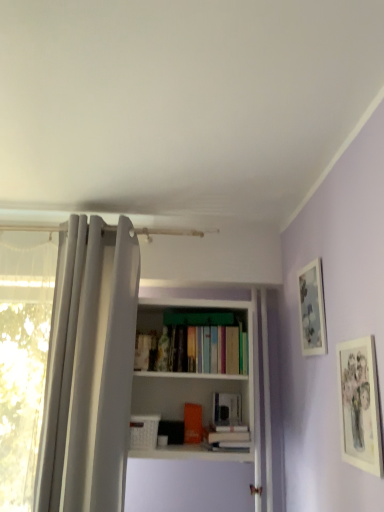
Where is `white fabric shower curtain at left`? The height and width of the screenshot is (512, 384). white fabric shower curtain at left is located at coordinates (92, 373).

This screenshot has width=384, height=512. Describe the element at coordinates (226, 409) in the screenshot. I see `hardcover book at center, placed as the 1th book when sorted from right to left` at that location.

In order to face white matte bookshelf at center, should I rotate leftwards or rightwards?

Rotate your view right by about 0.199°.

Measure the distance between point (x=373, y=339) and camera.

They are 1.10 meters apart.

The image size is (384, 512). What do you see at coordinates (312, 309) in the screenshot? I see `matte silver picture frame at upper right, which is the first picture frame from back to front` at bounding box center [312, 309].

The image size is (384, 512). What are the coordinates of `orange matte bookshelf at center, which is counted as the 1th book, starting from the left` in the screenshot? It's located at (192, 423).

Is white matte bookshelf at center at the right side of matte paper picture frame at right, the first picture frame viewed from the front?

In fact, white matte bookshelf at center is to the left of matte paper picture frame at right, the first picture frame viewed from the front.

Consider the image. Are white matte bookshelf at center and matte paper picture frame at right, the first picture frame viewed from the front, located far from each other?

No, white matte bookshelf at center is not far from matte paper picture frame at right, the first picture frame viewed from the front.

Is white matte bookshelf at center not inside matte paper picture frame at right, the first picture frame viewed from the front?

white matte bookshelf at center is positioned outside matte paper picture frame at right, the first picture frame viewed from the front.

Is white matte bookshelf at center smaller than matte paper picture frame at right, the first picture frame viewed from the front?

Actually, white matte bookshelf at center might be larger than matte paper picture frame at right, the first picture frame viewed from the front.

Is orange matte bookshelf at center, which is counted as the 1th book, starting from the left, next to white matte bookshelf at center and touching it?

No, orange matte bookshelf at center, which is counted as the 1th book, starting from the left, is not with white matte bookshelf at center.

Considering the sizes of objects orange matte bookshelf at center, the 2th book positioned from the right, and white matte bookshelf at center in the image provided, who is smaller, orange matte bookshelf at center, the 2th book positioned from the right, or white matte bookshelf at center?

Smaller between the two is orange matte bookshelf at center, the 2th book positioned from the right.

Which is more distant, (198,438) or (239,378)?

The point (198,438) is farther from the camera.

Is matte silver picture frame at upper right, which is the first picture frame from back to front, oriented away from white matte bookshelf at center?

No, matte silver picture frame at upper right, which is the first picture frame from back to front,'s orientation is not away from white matte bookshelf at center.

Identify the location of the 1st picture frame in front of the white matte bookshelf at center. The width and height of the screenshot is (384, 512). 312,309.

Based on the photo, is matte silver picture frame at upper right, which is the first picture frame from back to front, next to white matte bookshelf at center and touching it?

No, matte silver picture frame at upper right, which is the first picture frame from back to front, is not making contact with white matte bookshelf at center.

Is there a large distance between matte silver picture frame at upper right, the second picture frame when ordered from front to back, and matte paper picture frame at right, the first picture frame viewed from the front?

matte silver picture frame at upper right, the second picture frame when ordered from front to back, is actually quite close to matte paper picture frame at right, the first picture frame viewed from the front.

Would you say matte silver picture frame at upper right, which is the first picture frame from back to front, is to the left or to the right of matte paper picture frame at right, the first picture frame viewed from the front, in the picture?

From the image, it's evident that matte silver picture frame at upper right, which is the first picture frame from back to front, is to the left of matte paper picture frame at right, the first picture frame viewed from the front.

Is matte silver picture frame at upper right, which is the first picture frame from back to front, in front of or behind matte paper picture frame at right, which is counted as the second picture frame, starting from the back, in the image?

Clearly, matte silver picture frame at upper right, which is the first picture frame from back to front, is behind matte paper picture frame at right, which is counted as the second picture frame, starting from the back.

Based on their sizes in the image, would you say matte silver picture frame at upper right, which is the first picture frame from back to front, is bigger or smaller than matte paper picture frame at right, which is counted as the second picture frame, starting from the back?

In the image, matte silver picture frame at upper right, which is the first picture frame from back to front, appears to be larger than matte paper picture frame at right, which is counted as the second picture frame, starting from the back.

Is orange matte bookshelf at center, the 2th book positioned from the right, further to the viewer compared to matte paper picture frame at right, which is counted as the second picture frame, starting from the back?

Yes, orange matte bookshelf at center, the 2th book positioned from the right, is further from the camera.

Is orange matte bookshelf at center, which is counted as the 1th book, starting from the left, next to matte paper picture frame at right, the first picture frame viewed from the front, and touching it?

No, orange matte bookshelf at center, which is counted as the 1th book, starting from the left, is not with matte paper picture frame at right, the first picture frame viewed from the front.

Is white matte bookshelf at center wider than matte silver picture frame at upper right, the second picture frame when ordered from front to back?

Correct, the width of white matte bookshelf at center exceeds that of matte silver picture frame at upper right, the second picture frame when ordered from front to back.

What's the angular difference between white matte bookshelf at center and matte silver picture frame at upper right, the second picture frame when ordered from front to back,'s facing directions?

The angular difference between white matte bookshelf at center and matte silver picture frame at upper right, the second picture frame when ordered from front to back, is 90 degrees.

How distant is white matte bookshelf at center from matte silver picture frame at upper right, the second picture frame when ordered from front to back?

20.98 inches.

Identify the location of bookcase that appears below the matte silver picture frame at upper right, the second picture frame when ordered from front to back (from a real-world perspective). This screenshot has height=512, width=384. (203, 421).

Is white fabric shower curtain at left inside or outside of matte silver picture frame at upper right, the second picture frame when ordered from front to back?

white fabric shower curtain at left is not inside matte silver picture frame at upper right, the second picture frame when ordered from front to back, it's outside.

From the image's perspective, is white fabric shower curtain at left located above or below matte silver picture frame at upper right, which is the first picture frame from back to front?

From the image's perspective, white fabric shower curtain at left appears below matte silver picture frame at upper right, which is the first picture frame from back to front.

Is matte silver picture frame at upper right, the second picture frame when ordered from front to back, at the back of white fabric shower curtain at left?

That's not correct — white fabric shower curtain at left is not looking away from matte silver picture frame at upper right, the second picture frame when ordered from front to back.

Considering the relative sizes of white fabric shower curtain at left and matte silver picture frame at upper right, the second picture frame when ordered from front to back, in the image provided, is white fabric shower curtain at left smaller than matte silver picture frame at upper right, the second picture frame when ordered from front to back,?

No, white fabric shower curtain at left is not smaller than matte silver picture frame at upper right, the second picture frame when ordered from front to back.

Identify the location of bookcase below the matte paper picture frame at right, the first picture frame viewed from the front (from the image's perspective). (203, 421).

This screenshot has height=512, width=384. Find the location of `bookcase above the orange matte bookshelf at center, which is counted as the 1th book, starting from the left (from the image's perspective)`. bookcase above the orange matte bookshelf at center, which is counted as the 1th book, starting from the left (from the image's perspective) is located at coordinates (203, 421).

When comparing their distances from matte silver picture frame at upper right, which is the first picture frame from back to front, does orange matte bookshelf at center, the 2th book positioned from the right, or matte paper picture frame at right, the first picture frame viewed from the front, seem further?

The object further to matte silver picture frame at upper right, which is the first picture frame from back to front, is orange matte bookshelf at center, the 2th book positioned from the right.

From the image, which object appears to be nearer to matte silver picture frame at upper right, which is the first picture frame from back to front, white matte bookshelf at center or matte paper picture frame at right, the first picture frame viewed from the front?

matte paper picture frame at right, the first picture frame viewed from the front, is positioned closer to the anchor matte silver picture frame at upper right, which is the first picture frame from back to front.

Which object lies further to the anchor point matte silver picture frame at upper right, the second picture frame when ordered from front to back, white fabric shower curtain at left or orange matte bookshelf at center, the 2th book positioned from the right?

white fabric shower curtain at left is positioned further to the anchor matte silver picture frame at upper right, the second picture frame when ordered from front to back.

From the image, which object appears to be farther from matte paper picture frame at right, which is counted as the second picture frame, starting from the back, hardcover book at center, marked as the 2th book in a left-to-right arrangement, or white fabric shower curtain at left?

white fabric shower curtain at left is further to matte paper picture frame at right, which is counted as the second picture frame, starting from the back.

Looking at the image, which one is located closer to matte paper picture frame at right, which is counted as the second picture frame, starting from the back, white fabric shower curtain at left or matte silver picture frame at upper right, which is the first picture frame from back to front?

Among the two, matte silver picture frame at upper right, which is the first picture frame from back to front, is located nearer to matte paper picture frame at right, which is counted as the second picture frame, starting from the back.

Which object lies further to the anchor point matte paper picture frame at right, the first picture frame viewed from the front, hardcover book at center, placed as the 1th book when sorted from right to left, or white matte bookshelf at center?

hardcover book at center, placed as the 1th book when sorted from right to left, lies further to matte paper picture frame at right, the first picture frame viewed from the front, than the other object.

When comparing their distances from matte silver picture frame at upper right, which is the first picture frame from back to front, does orange matte bookshelf at center, which is counted as the 1th book, starting from the left, or white matte bookshelf at center seem closer?

Based on the image, white matte bookshelf at center appears to be nearer to matte silver picture frame at upper right, which is the first picture frame from back to front.

When comparing their distances from hardcover book at center, marked as the 2th book in a left-to-right arrangement, does orange matte bookshelf at center, which is counted as the 1th book, starting from the left, or white matte bookshelf at center seem further?

white matte bookshelf at center.

Locate an element on the screen. book located between white fabric shower curtain at left and white matte bookshelf at center in the left-right direction is located at coordinates (192, 423).

Identify the location of book between white fabric shower curtain at left and hardcover book at center, marked as the 2th book in a left-to-right arrangement, from left to right. Image resolution: width=384 pixels, height=512 pixels. (192, 423).

Where is `book between matte paper picture frame at right, which is counted as the second picture frame, starting from the back, and orange matte bookshelf at center, the 2th book positioned from the right, from front to back`? The height and width of the screenshot is (512, 384). book between matte paper picture frame at right, which is counted as the second picture frame, starting from the back, and orange matte bookshelf at center, the 2th book positioned from the right, from front to back is located at coordinates tap(226, 409).

Where is `bookcase between matte silver picture frame at upper right, which is the first picture frame from back to front, and orange matte bookshelf at center, the 2th book positioned from the right, in the up-down direction`? Image resolution: width=384 pixels, height=512 pixels. bookcase between matte silver picture frame at upper right, which is the first picture frame from back to front, and orange matte bookshelf at center, the 2th book positioned from the right, in the up-down direction is located at coordinates (203, 421).